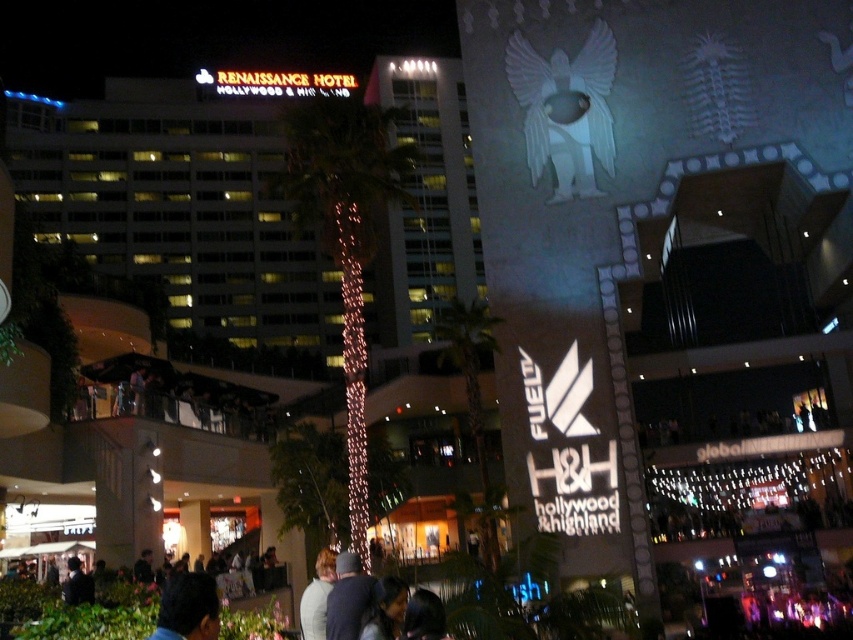
Question: Can you confirm if matte glass hotel at upper left is positioned above dark gray knit cap at lower center?

Choices:
 (A) no
 (B) yes

Answer: (B)

Question: Can you confirm if matte glass hotel at upper left is positioned above dark gray knit cap at lower center?

Choices:
 (A) yes
 (B) no

Answer: (A)

Question: Does matte glass hotel at upper left come behind dark gray knit cap at lower center?

Choices:
 (A) yes
 (B) no

Answer: (A)

Question: Which object appears closest to the camera in this image?

Choices:
 (A) dark gray knit cap at lower center
 (B) matte glass hotel at upper left

Answer: (A)

Question: Among these points, which one is nearest to the camera?

Choices:
 (A) (73, 168)
 (B) (351, 579)

Answer: (B)

Question: Which point appears closest to the camera in this image?

Choices:
 (A) (338, 628)
 (B) (463, 289)

Answer: (A)